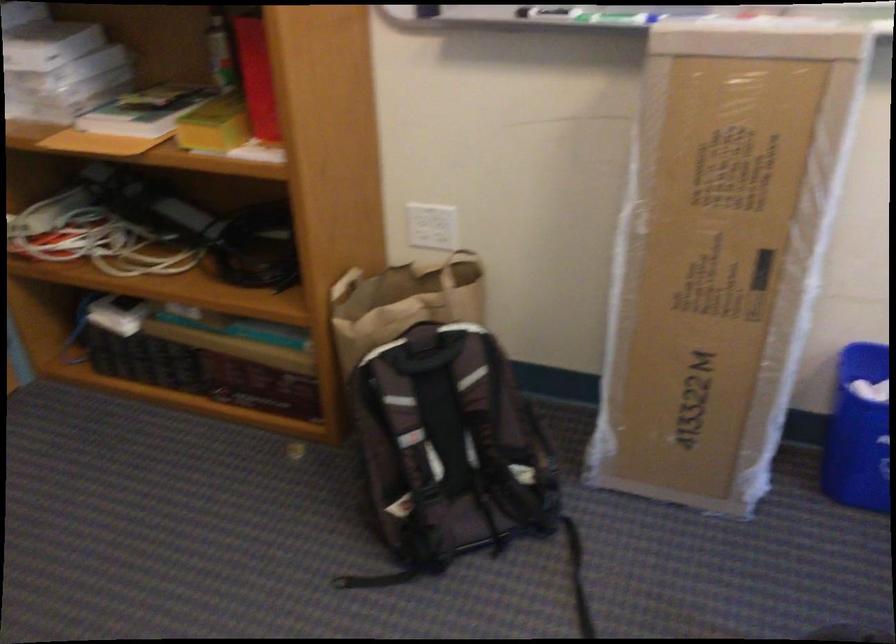
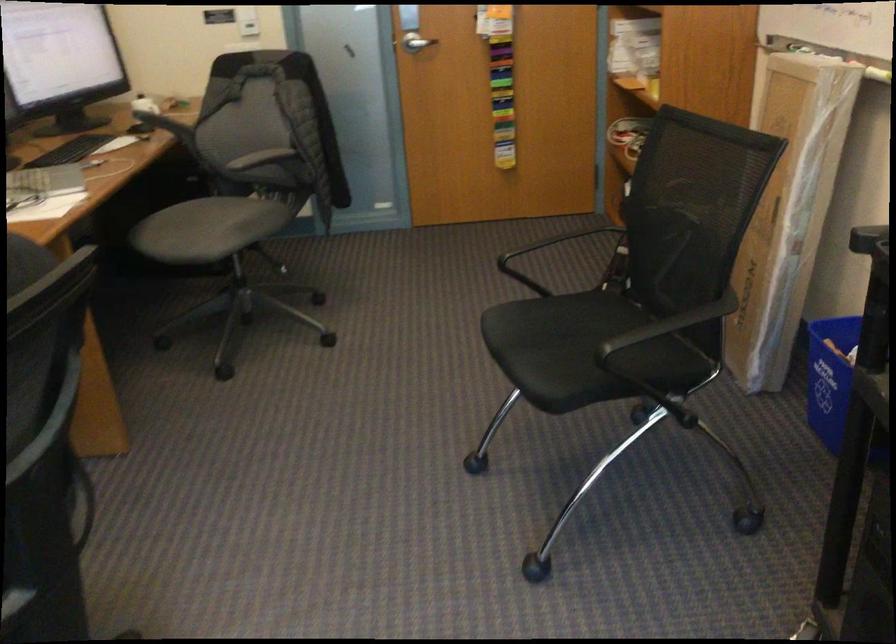
Find the pixel in the second image that matches point (754, 252) in the first image.

(788, 212)